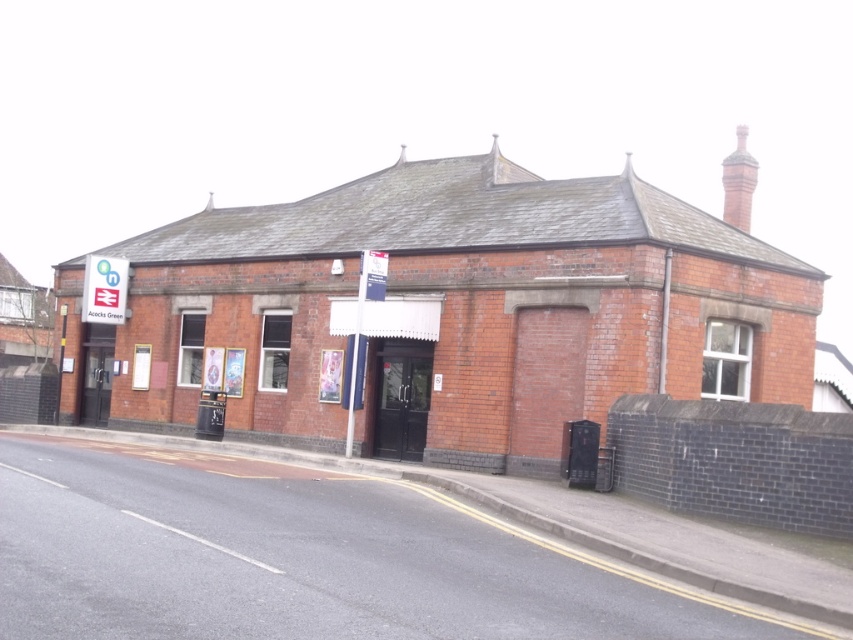
Looking at this image, you are standing at the entrance of the brick building and want to read the white plastic sign at center. Is the sign within a comfortable reading distance of 50 feet?

The white plastic sign at center is 56.31 feet away from viewer, which exceeds the comfortable reading distance of 50 feet, so it might be difficult to read comfortably.

You are standing in front of the brick building and want to read both signs. Which sign, the white plastic sign at center or the white plastic sign at upper left, is easier to read from your current position?

The white plastic sign at center is closer to the viewer than the white plastic sign at upper left, so it is easier to read from your current position.